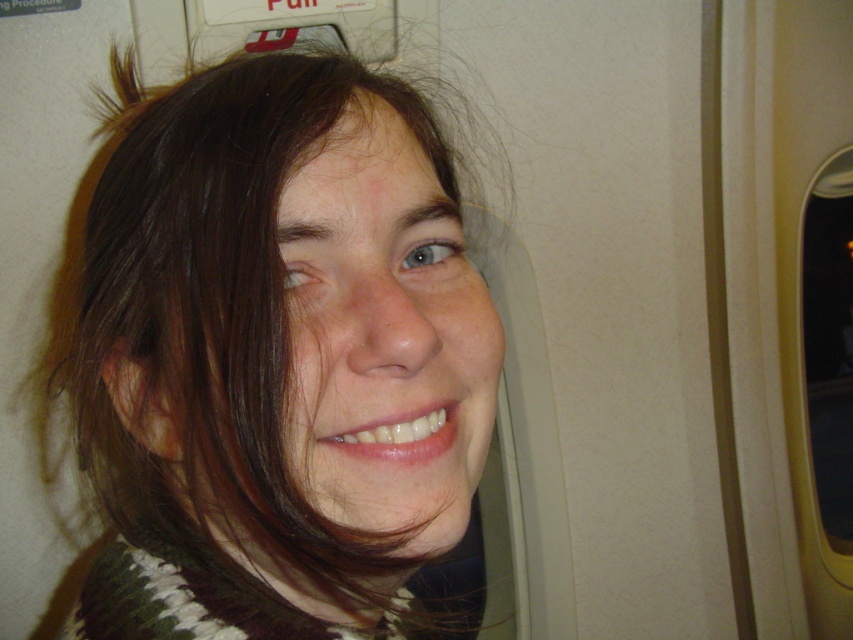
Based on the scene description, where is the dark brown hair located in relation to the point marked at coordinates (276, 355)?

The point at coordinates (276, 355) marks the location of the dark brown hair at center.

You are on an airplane and want to check the view outside through the transparent glass airplane window at right. However, your dark brown hair at center is blocking your view. Can you move your head slightly to see through the window without adjusting your seat?

The dark brown hair at center is closer to the viewer than the transparent glass airplane window at right, so moving your head slightly might allow you to see around your hair to the window.

You are a flight attendant checking seat assignments. You notice the dark brown hair at center and the transparent glass airplane window at right. Which object has a smaller width?

The dark brown hair at center has a smaller width than the transparent glass airplane window at right.